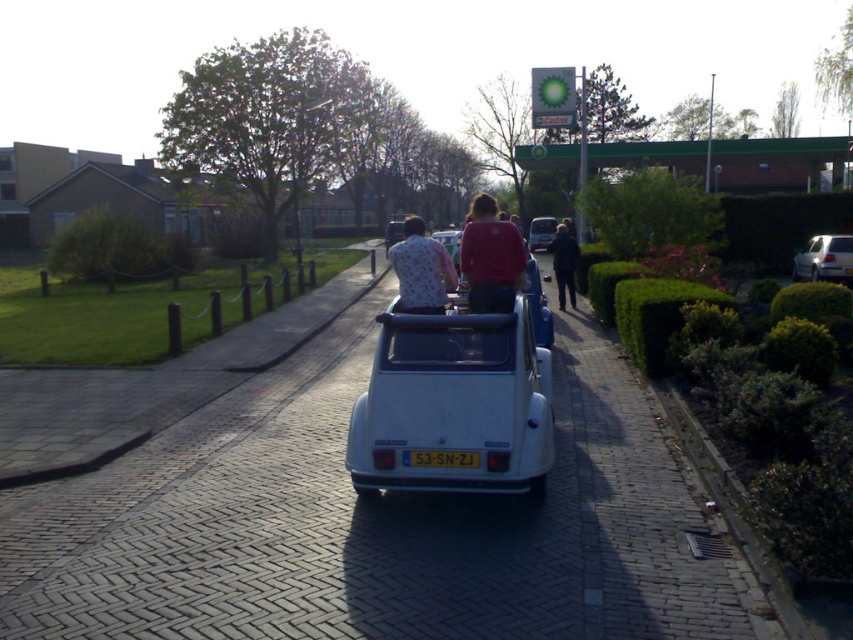
Is matte red shirt at center below white patterned shirt at center?

Indeed, matte red shirt at center is positioned under white patterned shirt at center.

Between matte red shirt at center and white patterned shirt at center, which one has less height?

matte red shirt at center

This screenshot has width=853, height=640. In order to click on matte red shirt at center in this screenshot , I will do `click(490, 259)`.

Locate an element on the screen. The image size is (853, 640). matte red shirt at center is located at coordinates (490, 259).

Looking at this image, who is more distant from viewer, [524,262] or [534,218]?

Point [534,218]

Can you confirm if matte red shirt at center is bigger than matte white car at center?

Actually, matte red shirt at center might be smaller than matte white car at center.

Between point (502, 248) and point (541, 241), which one is positioned behind?

The point (541, 241) is more distant.

The image size is (853, 640). Identify the location of matte red shirt at center. (490, 259).

Which of these two, silver metallic hatchback at right or dark blue jeans at center, stands taller?

dark blue jeans at center

Consider the image. Can you confirm if silver metallic hatchback at right is positioned below dark blue jeans at center?

Correct, silver metallic hatchback at right is located below dark blue jeans at center.

Where is `silver metallic hatchback at right`? The image size is (853, 640). silver metallic hatchback at right is located at coordinates (824, 259).